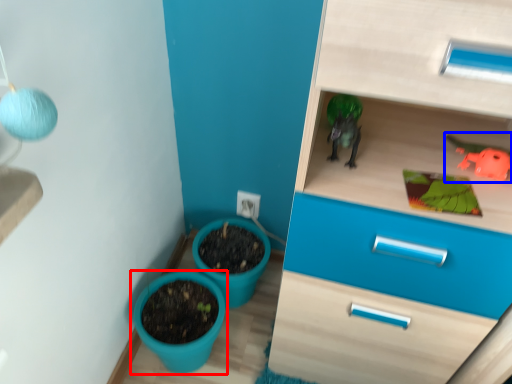
Question: Which object is closer to the camera taking this photo, flowerpot (highlighted by a red box) or toy (highlighted by a blue box)?

Choices:
 (A) flowerpot
 (B) toy

Answer: (B)